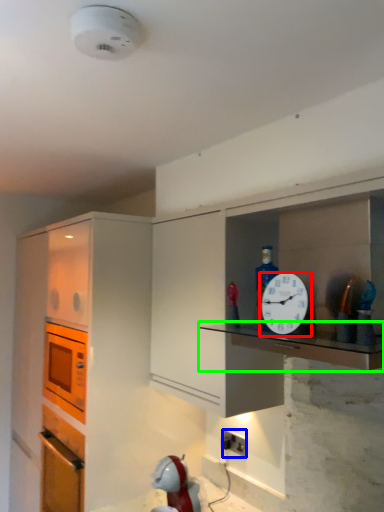
Question: Which is farther away from clock (highlighted by a red box)? electric outlet (highlighted by a blue box) or counter top (highlighted by a green box)?

Choices:
 (A) electric outlet
 (B) counter top

Answer: (A)